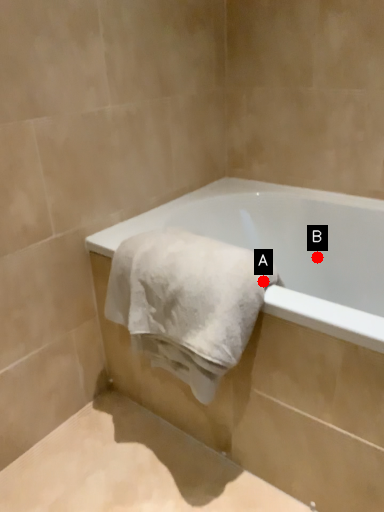
Question: Two points are circled on the image, labeled by A and B beside each circle. Among these points, which one is farthest from the camera?

Choices:
 (A) A is further
 (B) B is further

Answer: (B)